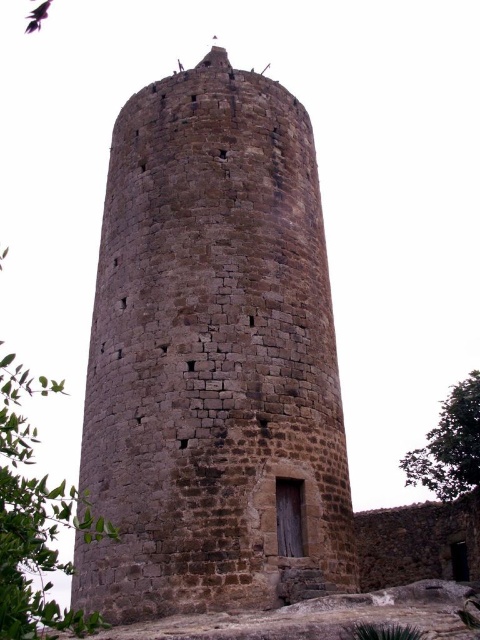
Who is shorter, brown stone tower at center or green leafy tree at right?

Standing shorter between the two is green leafy tree at right.

Between brown stone tower at center and green leafy tree at right, which one appears on the left side from the viewer's perspective?

brown stone tower at center

Between point (324, 285) and point (478, 432), which one is positioned behind?

The point (478, 432) is more distant.

This screenshot has height=640, width=480. I want to click on brown stone tower at center, so click(x=213, y=358).

Based on the photo, is green leafy tree at left positioned behind green leafy tree at right?

No, green leafy tree at left is in front of green leafy tree at right.

Which is more to the left, green leafy tree at left or green leafy tree at right?

green leafy tree at left

I want to click on green leafy tree at left, so click(x=35, y=518).

Find the location of a particular element. green leafy tree at left is located at coordinates (35, 518).

This screenshot has width=480, height=640. Describe the element at coordinates (213, 358) in the screenshot. I see `brown stone tower at center` at that location.

Can you confirm if brown stone tower at center is smaller than green leafy tree at left?

Indeed, brown stone tower at center has a smaller size compared to green leafy tree at left.

Is point (165, 150) positioned after point (52, 518)?

No, it is not.

Image resolution: width=480 pixels, height=640 pixels. I want to click on brown stone tower at center, so click(213, 358).